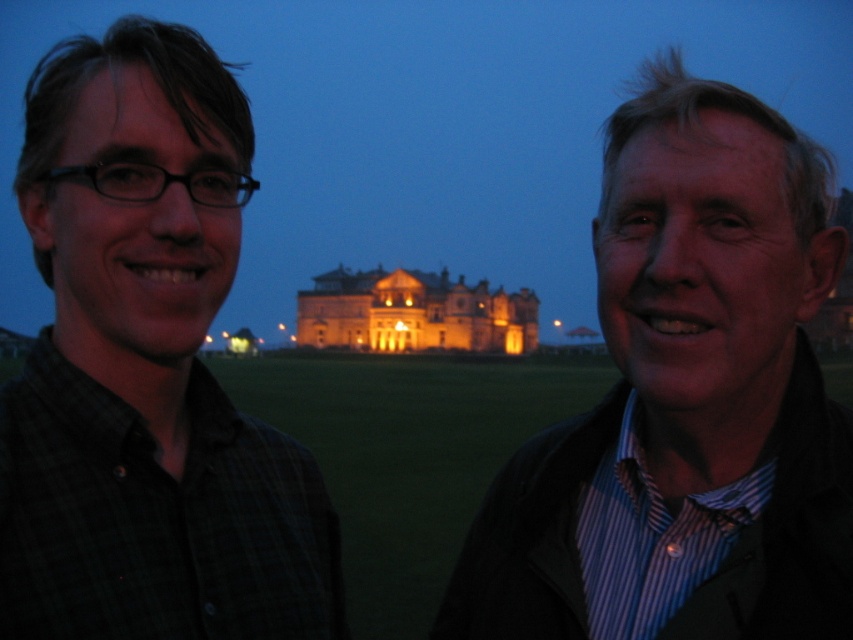
Question: Which point is closer to the camera?

Choices:
 (A) (485, 340)
 (B) (318, 534)
 (C) (706, 250)

Answer: (C)

Question: Is the position of striped shirt at center more distant than that of golden illuminated palace at center?

Choices:
 (A) yes
 (B) no

Answer: (B)

Question: Is striped shirt at center wider than golden illuminated palace at center?

Choices:
 (A) yes
 (B) no

Answer: (B)

Question: Which object is farther from the camera taking this photo?

Choices:
 (A) golden illuminated palace at center
 (B) striped shirt at center
 (C) checkered shirt at left

Answer: (A)

Question: Is striped shirt at center to the left of checkered shirt at left from the viewer's perspective?

Choices:
 (A) yes
 (B) no

Answer: (B)

Question: Based on their relative distances, which object is farther from the golden illuminated palace at center?

Choices:
 (A) checkered shirt at left
 (B) striped shirt at center

Answer: (A)